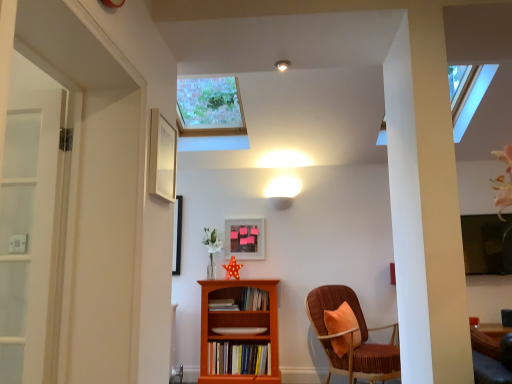
Question: From the image's perspective, is hardcover books at center, acting as the 1th book starting from the bottom, positioned above or below matte wooden picture frame at center, which appears as the 1th picture frame when viewed from the back?

Choices:
 (A) above
 (B) below

Answer: (B)

Question: In terms of size, does hardcover books at center, placed as the fourth book when sorted from top to bottom, appear bigger or smaller than matte wooden picture frame at center, placed as the 1th picture frame when sorted from right to left?

Choices:
 (A) big
 (B) small

Answer: (A)

Question: Which object is positioned closest to the orange wood bookcase at center?

Choices:
 (A) matte wooden picture frame at center, which appears as the 1th picture frame when viewed from the back
 (B) matte white book at center, the 3th book from the top
 (C) white matte picture frame at upper center, which is the second picture frame from right to left
 (D) hardcover books at center, acting as the 1th book starting from the bottom
 (E) matte white ceiling light at upper center

Answer: (D)

Question: Based on their relative distances, which object is farther from the white matte picture frame at upper center, which is counted as the first picture frame, starting from the top?

Choices:
 (A) wooden book at center, which appears as the third book when ordered from the bottom
 (B) matte white ceiling light at upper center
 (C) velvet brown chair at right
 (D) matte wooden picture frame at center, the 2th picture frame positioned from the front
 (E) hardcover books at center, acting as the 1th book starting from the bottom

Answer: (E)